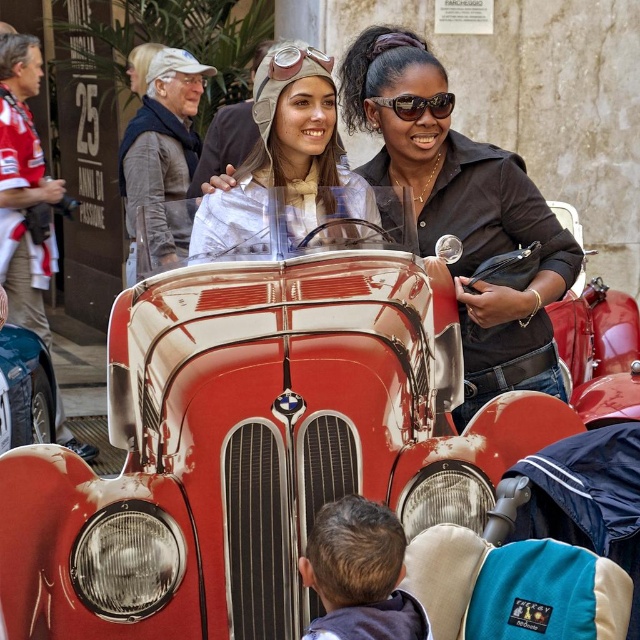
Question: Which point is farther from the camera taking this photo?

Choices:
 (A) (609, 371)
 (B) (301, 156)
 (C) (460, 284)
 (D) (410, 100)

Answer: (A)

Question: Can you confirm if black leather jacket at center is thinner than metallic silver helmet at center?

Choices:
 (A) no
 (B) yes

Answer: (A)

Question: Which object is the farthest from the shiny silver aviator goggles at upper center?

Choices:
 (A) black leather jacket at center
 (B) shiny red car at center
 (C) metallic silver helmet at center

Answer: (B)

Question: Among these points, which one is nearest to the camera?

Choices:
 (A) (433, 154)
 (B) (408, 276)
 (C) (369, 97)

Answer: (B)

Question: Does shiny red car at center have a lesser width compared to black leather jacket at center?

Choices:
 (A) yes
 (B) no

Answer: (B)

Question: Is shiny red car at center further to camera compared to black leather jacket at center?

Choices:
 (A) yes
 (B) no

Answer: (B)